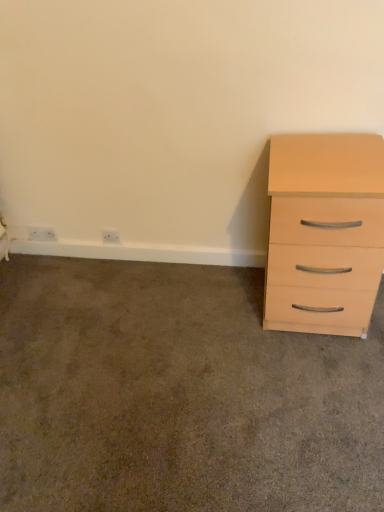
Question: Can you confirm if white plastic electric outlet at lower left, which ranks as the first electric outlet in left-to-right order, is thinner than white plastic outlet at lower left, which ranks as the first electric outlet in right-to-left order?

Choices:
 (A) yes
 (B) no

Answer: (A)

Question: From the image's perspective, is white plastic electric outlet at lower left, which ranks as the first electric outlet in left-to-right order, beneath white plastic outlet at lower left, which ranks as the first electric outlet in right-to-left order?

Choices:
 (A) yes
 (B) no

Answer: (B)

Question: Considering the relative sizes of white plastic electric outlet at lower left, the 2th electric outlet when ordered from right to left, and white plastic outlet at lower left, which ranks as the first electric outlet in right-to-left order, in the image provided, is white plastic electric outlet at lower left, the 2th electric outlet when ordered from right to left, taller than white plastic outlet at lower left, which ranks as the first electric outlet in right-to-left order,?

Choices:
 (A) no
 (B) yes

Answer: (B)

Question: Is white plastic electric outlet at lower left, the 2th electric outlet when ordered from right to left, turned away from white plastic outlet at lower left, the second electric outlet from the left?

Choices:
 (A) yes
 (B) no

Answer: (B)

Question: Does white plastic electric outlet at lower left, which ranks as the first electric outlet in left-to-right order, turn towards white plastic outlet at lower left, the second electric outlet from the left?

Choices:
 (A) no
 (B) yes

Answer: (A)

Question: Is white plastic electric outlet at lower left, the 2th electric outlet when ordered from right to left, in front of or behind white plastic outlet at lower left, the second electric outlet from the left, in the image?

Choices:
 (A) front
 (B) behind

Answer: (B)

Question: Do you think white plastic electric outlet at lower left, the 2th electric outlet when ordered from right to left, is within white plastic outlet at lower left, which ranks as the first electric outlet in right-to-left order, or outside of it?

Choices:
 (A) inside
 (B) outside

Answer: (B)

Question: In terms of width, does white plastic electric outlet at lower left, which ranks as the first electric outlet in left-to-right order, look wider or thinner when compared to white plastic outlet at lower left, the second electric outlet from the left?

Choices:
 (A) thin
 (B) wide

Answer: (A)

Question: Is white plastic electric outlet at lower left, which ranks as the first electric outlet in left-to-right order, bigger or smaller than white plastic outlet at lower left, which ranks as the first electric outlet in right-to-left order?

Choices:
 (A) small
 (B) big

Answer: (B)

Question: Is light wood/finish chest of drawers at right inside or outside of beige wood drawer at right?

Choices:
 (A) outside
 (B) inside

Answer: (A)

Question: From a real-world perspective, is light wood/finish chest of drawers at right above or below beige wood drawer at right?

Choices:
 (A) above
 (B) below

Answer: (A)

Question: From the image's perspective, is light wood/finish chest of drawers at right positioned above or below beige wood drawer at right?

Choices:
 (A) above
 (B) below

Answer: (A)

Question: Looking at their shapes, would you say light wood/finish chest of drawers at right is wider or thinner than beige wood drawer at right?

Choices:
 (A) wide
 (B) thin

Answer: (B)

Question: Based on their positions, is white plastic outlet at lower left, which ranks as the first electric outlet in right-to-left order, located to the left or right of beige wood drawer at right?

Choices:
 (A) right
 (B) left

Answer: (B)

Question: Looking at their shapes, would you say white plastic outlet at lower left, the second electric outlet from the left, is wider or thinner than beige wood drawer at right?

Choices:
 (A) thin
 (B) wide

Answer: (A)